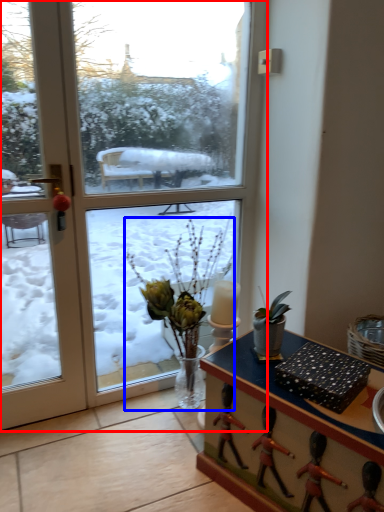
Question: Which object is closer to the camera taking this photo, window (highlighted by a red box) or houseplant (highlighted by a blue box)?

Choices:
 (A) window
 (B) houseplant

Answer: (A)